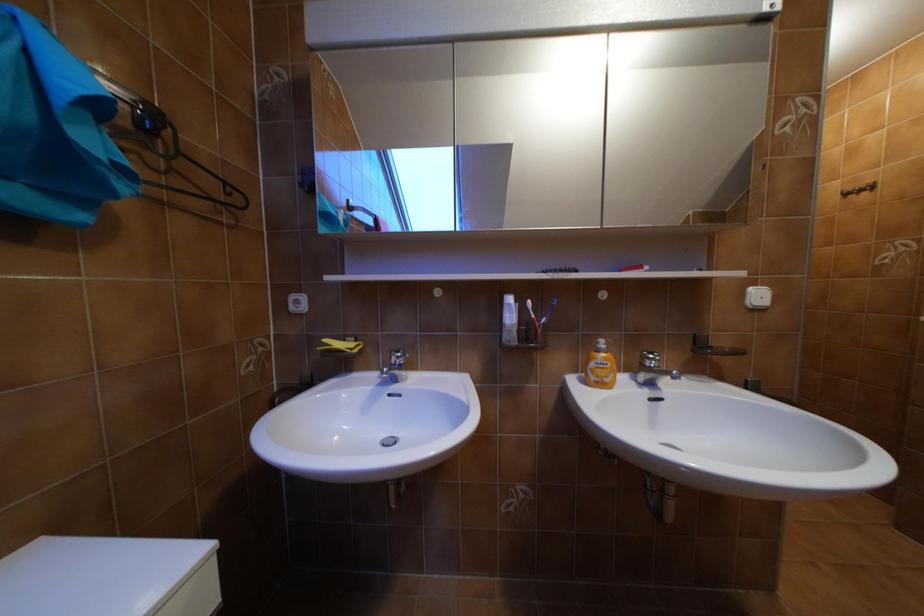
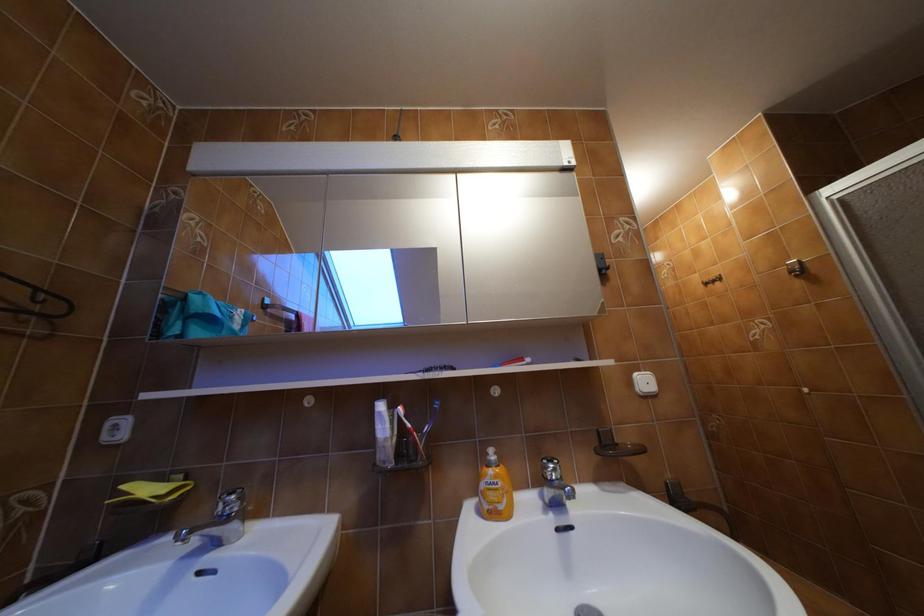
Question: Based on the continuous images, in which direction is the camera rotating? Reply with the corresponding letter.

Choices:
 (A) Left
 (B) Right
 (C) Up
 (D) Down

Answer: (C)